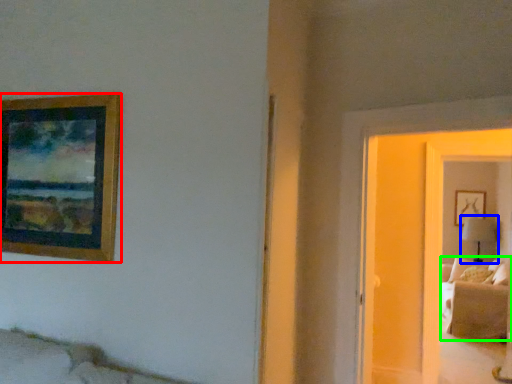
Question: Based on their relative distances, which object is farther from picture frame (highlighted by a red box)? Choose from table lamp (highlighted by a blue box) and couch (highlighted by a green box).

Choices:
 (A) table lamp
 (B) couch

Answer: (A)